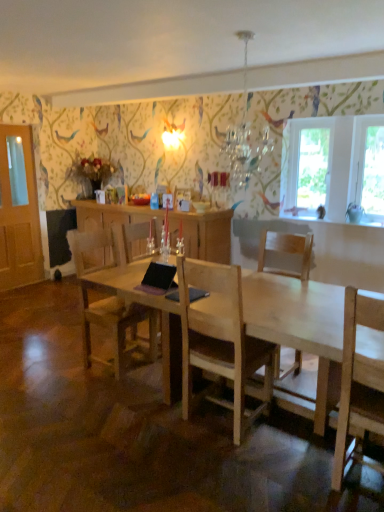
Question: Does light brown wooden chair at center, arranged as the second chair when viewed from the right, appear on the left side of transparent glass window at upper right, marked as the first window screen in a left-to-right arrangement?

Choices:
 (A) yes
 (B) no

Answer: (A)

Question: Can you confirm if light brown wooden chair at center, the first chair viewed from the left, is thinner than transparent glass window at upper right, marked as the first window screen in a left-to-right arrangement?

Choices:
 (A) yes
 (B) no

Answer: (B)

Question: From the image's perspective, is light brown wooden chair at center, arranged as the second chair when viewed from the right, over transparent glass window at upper right, marked as the first window screen in a left-to-right arrangement?

Choices:
 (A) yes
 (B) no

Answer: (B)

Question: Would you say light brown wooden chair at center, arranged as the second chair when viewed from the right, is outside transparent glass window at upper right, marked as the first window screen in a left-to-right arrangement?

Choices:
 (A) yes
 (B) no

Answer: (A)

Question: Is the depth of light brown wooden chair at center, arranged as the second chair when viewed from the right, less than that of transparent glass window at upper right, marked as the first window screen in a left-to-right arrangement?

Choices:
 (A) yes
 (B) no

Answer: (A)

Question: Can you confirm if light brown wooden chair at center, the first chair viewed from the left, is shorter than transparent glass window at upper right, the second window screen positioned from the right?

Choices:
 (A) yes
 (B) no

Answer: (B)

Question: Would you consider light wood chair at center, arranged as the 1th chair when viewed from the right, to be distant from black matte laptop at center?

Choices:
 (A) yes
 (B) no

Answer: (A)

Question: From the image's perspective, is light wood chair at center, arranged as the 1th chair when viewed from the right, located beneath black matte laptop at center?

Choices:
 (A) no
 (B) yes

Answer: (B)

Question: From a real-world perspective, is light wood chair at center, which ranks as the 2th chair in left-to-right order, beneath black matte laptop at center?

Choices:
 (A) no
 (B) yes

Answer: (B)

Question: Is light wood chair at center, arranged as the 1th chair when viewed from the right, thinner than black matte laptop at center?

Choices:
 (A) no
 (B) yes

Answer: (A)

Question: Does light wood chair at center, arranged as the 1th chair when viewed from the right, appear on the left side of black matte laptop at center?

Choices:
 (A) no
 (B) yes

Answer: (A)

Question: Is black matte laptop at center located within light wood chair at center, arranged as the 1th chair when viewed from the right?

Choices:
 (A) no
 (B) yes

Answer: (A)

Question: Is transparent glass window at upper right, marked as the first window screen in a left-to-right arrangement, located outside light wood chair at center, which ranks as the 2th chair in left-to-right order?

Choices:
 (A) yes
 (B) no

Answer: (A)